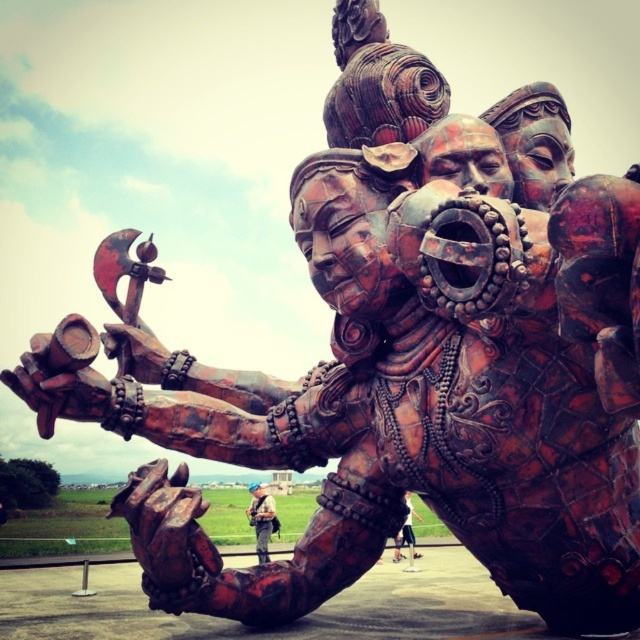
Question: Which object is farther from the camera taking this photo?

Choices:
 (A) matte brown leather jacket at lower center
 (B) metallic helmet at center

Answer: (B)

Question: Does metallic helmet at center have a greater width compared to matte brown leather jacket at lower center?

Choices:
 (A) yes
 (B) no

Answer: (B)

Question: Among these points, which one is nearest to the camera?

Choices:
 (A) (269, 538)
 (B) (410, 536)

Answer: (A)

Question: Does metallic helmet at center appear under matte brown leather jacket at lower center?

Choices:
 (A) yes
 (B) no

Answer: (A)

Question: Does metallic helmet at center appear over matte brown leather jacket at lower center?

Choices:
 (A) yes
 (B) no

Answer: (B)